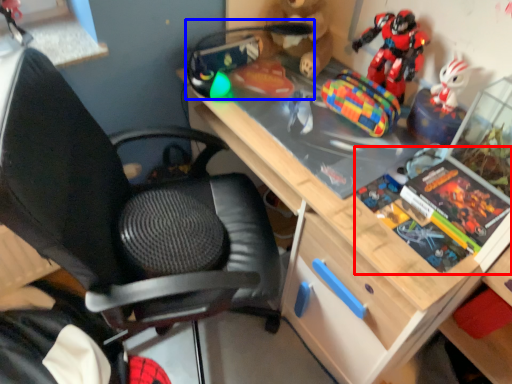
Question: Which object is closer to the camera taking this photo, book (highlighted by a red box) or toy (highlighted by a blue box)?

Choices:
 (A) book
 (B) toy

Answer: (A)